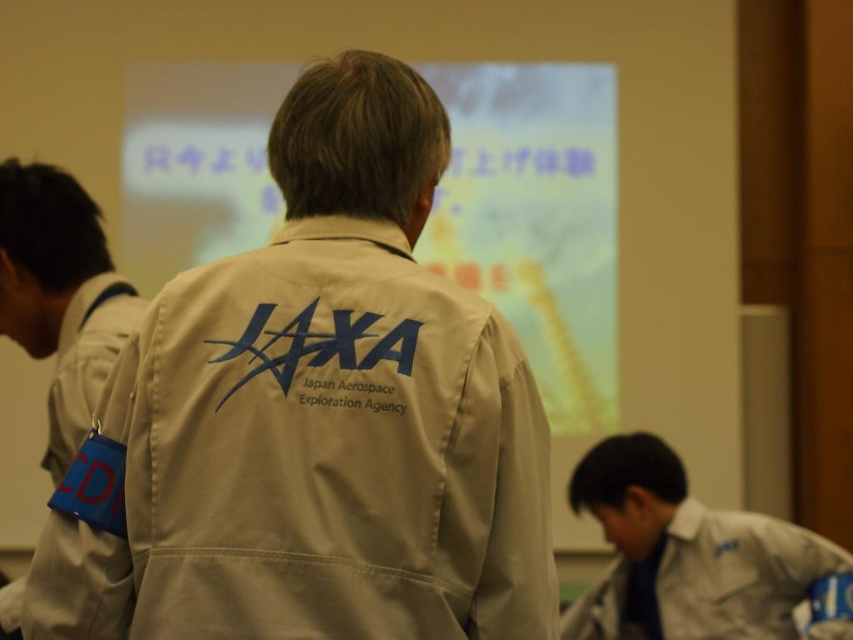
You are an intern at JAXA and need to hand out materials to both the person wearing the beige fabric lab coat at center and the person in the beige fabric uniform at lower right. Since you can only move forward in a straight line, which individual will you reach first?

You will reach the beige fabric lab coat at center first because it is closer to the viewer than the beige fabric uniform at lower right.

Consider the image. You are an astronaut preparing for a mission briefing. You need to determine if your equipment can fit in the available space. Given the beige fabric lab coat at center and the matte white projection screen at center, which object is smaller in size?

The beige fabric lab coat at center is smaller in size compared to the matte white projection screen at center.

You are standing in a room with three JAXA personnel. There is a point at coordinates point (x=346, y=371). If you want to place a 1.5 meter long pole from the camera to this point, will it reach?

The distance of point (x=346, y=371) from camera is 1.41 meters, so the pole will reach because it is shorter than the pole length.